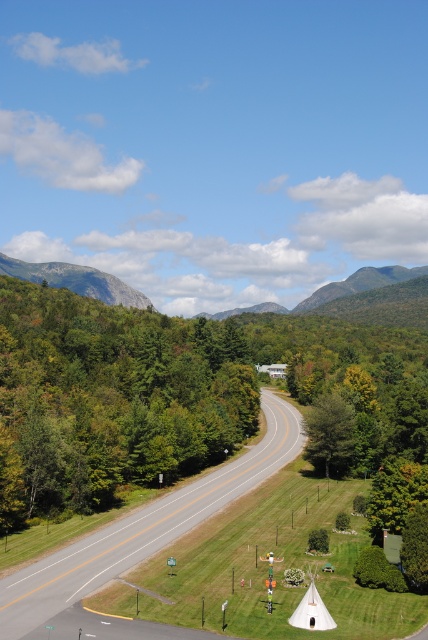
Is asphalt road at center to the left of green matte tree at center from the viewer's perspective?

Correct, you'll find asphalt road at center to the left of green matte tree at center.

Who is positioned more to the right, asphalt road at center or green matte tree at center?

green matte tree at center is more to the right.

Measure the distance between point [225,500] and camera.

Point [225,500] is 328.85 feet from camera.

At what (x,y) coordinates should I click in order to perform the action: click on asphalt road at center. Please return your answer as a coordinate pair (x, y). Looking at the image, I should click on (145, 528).

Looking at this image, is gray rock formation at upper left below green matte tree at center?

Answer: Actually, gray rock formation at upper left is above green matte tree at center.

Between point (24, 275) and point (317, 460), which one is positioned behind?

The point (24, 275) is more distant.

Identify the location of gray rock formation at upper left. (77, 280).

Is green leafy tree at left below gray rock formation at upper left?

Indeed, green leafy tree at left is positioned under gray rock formation at upper left.

Which of these two, green leafy tree at left or gray rock formation at upper left, stands taller?

Standing taller between the two is green leafy tree at left.

Who is more distant from viewer, (70,470) or (61,275)?

The point (61,275) is more distant.

You are a GUI agent. You are given a task and a screenshot of the screen. Output one action in this format:
    pyautogui.click(x=<x>, y=<y>)
    Task: Click on the green leafy tree at left
    The width and height of the screenshot is (428, 640).
    Given the screenshot: What is the action you would take?
    pyautogui.click(x=110, y=400)